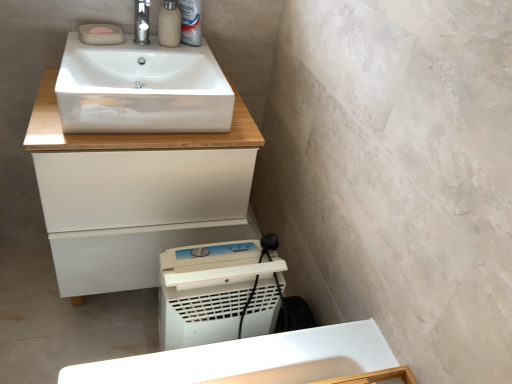
Identify the location of white plastic washing machine at lower center. This screenshot has width=512, height=384. (216, 293).

Image resolution: width=512 pixels, height=384 pixels. What are the coordinates of `white glossy sink at upper center` in the screenshot? It's located at (142, 88).

The width and height of the screenshot is (512, 384). Describe the element at coordinates (169, 24) in the screenshot. I see `matte beige soap dispenser at upper center` at that location.

Image resolution: width=512 pixels, height=384 pixels. I want to click on white plastic washing machine at lower center, so click(x=216, y=293).

Is white glossy cabinet at upper center positioned far away from pink matte soap at upper left?

No.

Which object is further away from the camera taking this photo, white glossy cabinet at upper center or pink matte soap at upper left?

pink matte soap at upper left is more distant.

Is white glossy cabinet at upper center outside of pink matte soap at upper left?

That's correct, white glossy cabinet at upper center is outside of pink matte soap at upper left.

Is point (129, 179) closer or farther from the camera than point (98, 30)?

Point (129, 179).

Is pink matte soap at upper left smaller than white glossy sink at upper center?

Yes.

Would you consider pink matte soap at upper left to be distant from white glossy sink at upper center?

Actually, pink matte soap at upper left and white glossy sink at upper center are a little close together.

From a real-world perspective, who is located higher, pink matte soap at upper left or white glossy sink at upper center?

In real-world perspective, pink matte soap at upper left is above.

Does white glossy cabinet at upper center have a greater width compared to white plastic can at upper center?

Yes.

Is white glossy cabinet at upper center outside of white plastic can at upper center?

Yes, white glossy cabinet at upper center is outside of white plastic can at upper center.

Considering the positions of objects white glossy cabinet at upper center and white plastic can at upper center in the image provided, who is behind, white glossy cabinet at upper center or white plastic can at upper center?

Positioned behind is white plastic can at upper center.

From the image's perspective, is white glossy cabinet at upper center below white plastic can at upper center?

Correct, white glossy cabinet at upper center appears lower than white plastic can at upper center in the image.

Is white glossy cabinet at upper center positioned with its back to white glossy sink at upper center?

No.

Is white glossy cabinet at upper center beside white glossy sink at upper center?

No.

Does point (76, 208) lie behind point (227, 86)?

No, (76, 208) is in front of (227, 86).

Is matte beige soap dispenser at upper center not close to polished chrome tap at upper center?

No, matte beige soap dispenser at upper center is not far away from polished chrome tap at upper center.

Image resolution: width=512 pixels, height=384 pixels. Find the location of `tap in front of the matte beige soap dispenser at upper center`. tap in front of the matte beige soap dispenser at upper center is located at coordinates (141, 22).

How many degrees apart are the facing directions of matte beige soap dispenser at upper center and polished chrome tap at upper center?

0.00104 degrees separate the facing orientations of matte beige soap dispenser at upper center and polished chrome tap at upper center.

Who is shorter, matte beige soap dispenser at upper center or polished chrome tap at upper center?

With less height is polished chrome tap at upper center.

In terms of size, does white plastic washing machine at lower center appear bigger or smaller than white plastic can at upper center?

Clearly, white plastic washing machine at lower center is larger in size than white plastic can at upper center.

Considering the relative sizes of white plastic washing machine at lower center and white plastic can at upper center in the image provided, is white plastic washing machine at lower center taller than white plastic can at upper center?

Yes.

Is point (170, 329) closer or farther from the camera than point (184, 42)?

Point (170, 329) is positioned closer to the camera compared to point (184, 42).

Which object is wider, white plastic washing machine at lower center or white plastic can at upper center?

white plastic washing machine at lower center is wider.

Considering the positions of objects white glossy cabinet at upper center and polished chrome tap at upper center in the image provided, who is more to the left, white glossy cabinet at upper center or polished chrome tap at upper center?

Positioned to the left is white glossy cabinet at upper center.

Consider the image. Is white glossy cabinet at upper center directly adjacent to polished chrome tap at upper center?

There is a gap between white glossy cabinet at upper center and polished chrome tap at upper center.

Is polished chrome tap at upper center located within white glossy cabinet at upper center?

Definitely not — polished chrome tap at upper center is not inside white glossy cabinet at upper center.

In the scene shown: Which of these two, white glossy cabinet at upper center or polished chrome tap at upper center, stands shorter?

Standing shorter between the two is polished chrome tap at upper center.

Find the location of a particular element. bathroom cabinet below the pink matte soap at upper left (from the image's perspective) is located at coordinates (139, 195).

There is a white glossy sink at upper center. Where is `soap above it (from a real-world perspective)`? The width and height of the screenshot is (512, 384). soap above it (from a real-world perspective) is located at coordinates (101, 30).

Consider the image. Considering their positions, is white plastic washing machine at lower center positioned further to polished chrome tap at upper center than matte beige soap dispenser at upper center?

Among the two, white plastic washing machine at lower center is located further to polished chrome tap at upper center.

Considering their positions, is white plastic washing machine at lower center positioned further to white glossy cabinet at upper center than pink matte soap at upper left?

Among the two, pink matte soap at upper left is located further to white glossy cabinet at upper center.

Looking at this image, from the image, which object appears to be nearer to white glossy sink at upper center, polished chrome tap at upper center or white plastic can at upper center?

Among the two, polished chrome tap at upper center is located nearer to white glossy sink at upper center.

From the image, which object appears to be farther from white glossy cabinet at upper center, pink matte soap at upper left or white plastic washing machine at lower center?

The object further to white glossy cabinet at upper center is pink matte soap at upper left.

Based on their spatial positions, is white glossy sink at upper center or matte beige soap dispenser at upper center further from white plastic washing machine at lower center?

matte beige soap dispenser at upper center lies further to white plastic washing machine at lower center than the other object.

From the picture: Which object lies nearer to the anchor point white plastic washing machine at lower center, pink matte soap at upper left or white glossy sink at upper center?

Among the two, white glossy sink at upper center is located nearer to white plastic washing machine at lower center.

When comparing their distances from matte beige soap dispenser at upper center, does white plastic washing machine at lower center or white glossy cabinet at upper center seem closer?

white glossy cabinet at upper center.

Which object lies further to the anchor point white plastic can at upper center, white glossy sink at upper center or white glossy cabinet at upper center?

Based on the image, white glossy cabinet at upper center appears to be further to white plastic can at upper center.

Find the location of a particular element. Image resolution: width=512 pixels, height=384 pixels. tap between matte beige soap dispenser at upper center and white glossy cabinet at upper center vertically is located at coordinates [141, 22].

This screenshot has height=384, width=512. I want to click on soap that lies between white plastic can at upper center and white plastic washing machine at lower center from top to bottom, so click(101, 30).

Locate an element on the screen. The image size is (512, 384). tap located between pink matte soap at upper left and matte beige soap dispenser at upper center in the left-right direction is located at coordinates (141, 22).

Find the location of a particular element. sink between white plastic can at upper center and white glossy cabinet at upper center from top to bottom is located at coordinates (142, 88).